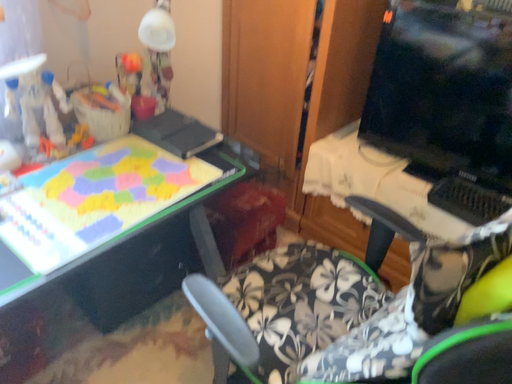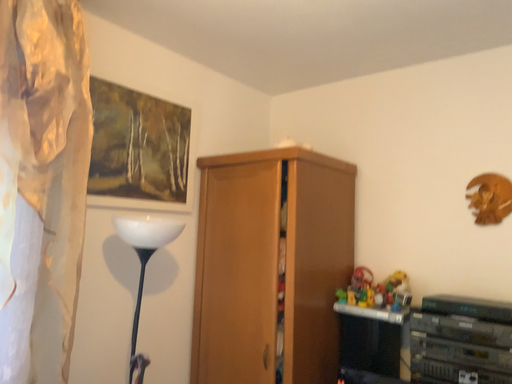
Question: How did the camera likely rotate when shooting the video?

Choices:
 (A) rotated upward
 (B) rotated downward

Answer: (A)